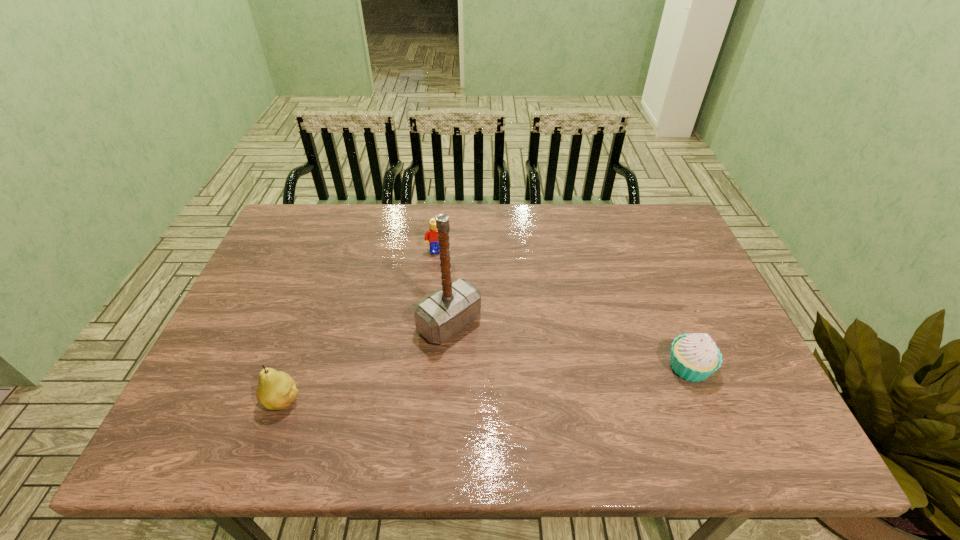
Image resolution: width=960 pixels, height=540 pixels. In the image, there is a desktop. Find the location of `vacant space at the left edge`. vacant space at the left edge is located at coordinates (283, 262).

Locate an element on the screen. free location at the far left corner is located at coordinates (333, 214).

Identify the location of vacant space at the far right corner of the desktop. (636, 235).

You are a GUI agent. You are given a task and a screenshot of the screen. Output one action in this format:
    pyautogui.click(x=<x>, y=<y>)
    Task: Click on the empty space between the second farthest object and the cupcake
    The image size is (960, 540).
    Given the screenshot: What is the action you would take?
    pyautogui.click(x=569, y=345)

Find the location of `free space between the rightmost object and the hammer`. free space between the rightmost object and the hammer is located at coordinates tap(569, 345).

Identify the location of free spot between the third nearest object and the leftmost object. This screenshot has width=960, height=540. (367, 361).

Image resolution: width=960 pixels, height=540 pixels. I want to click on vacant space in between the hammer and the leftmost object, so click(367, 361).

I want to click on free spot between the cupcake and the Lego, so click(x=564, y=309).

Find the location of a particular element. The width and height of the screenshot is (960, 540). free space between the rightmost object and the hammer is located at coordinates (569, 345).

Find the location of `free space between the rightmost object and the hammer`. free space between the rightmost object and the hammer is located at coordinates (569, 345).